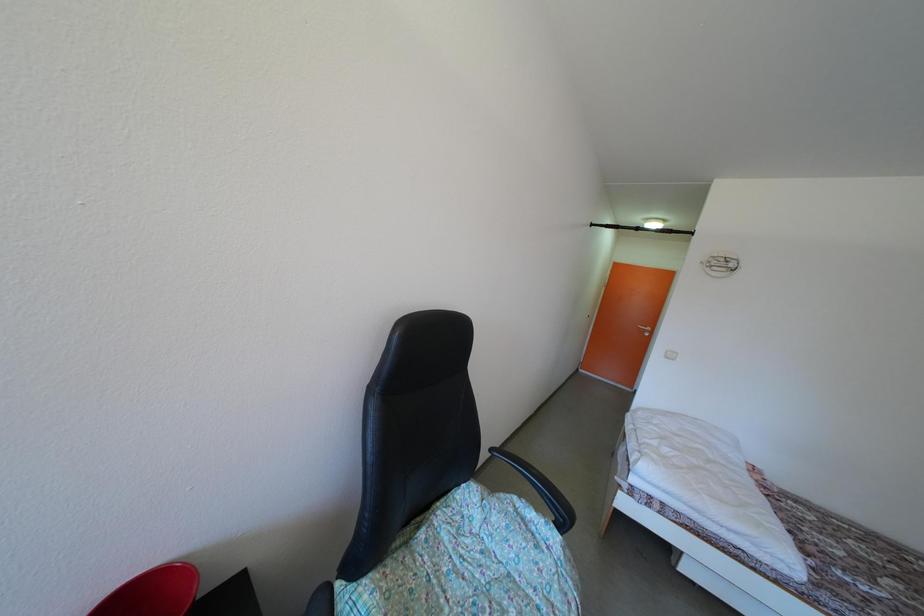
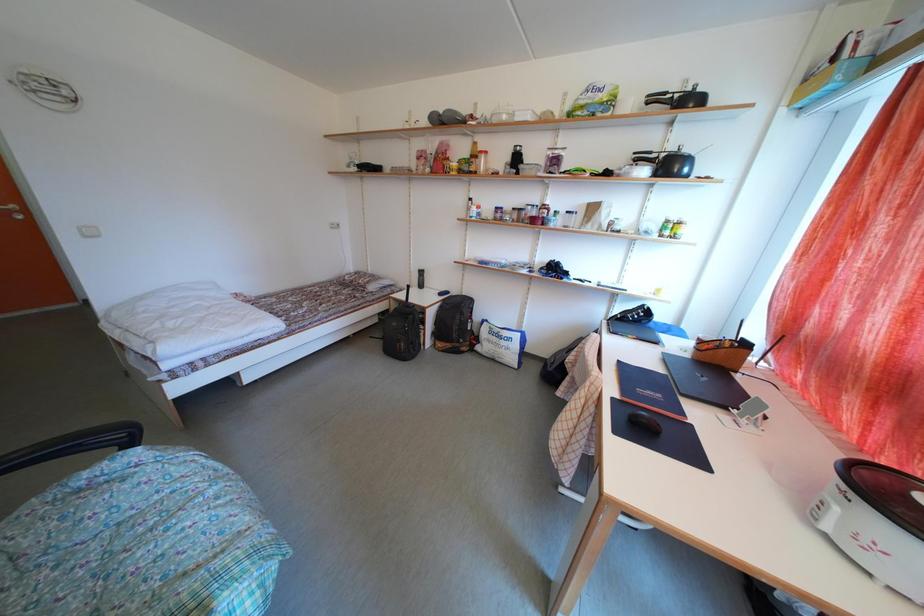
Based on the photo, first-person continuous shooting, in which direction is the camera rotating?

The camera's rotation is toward right-down.